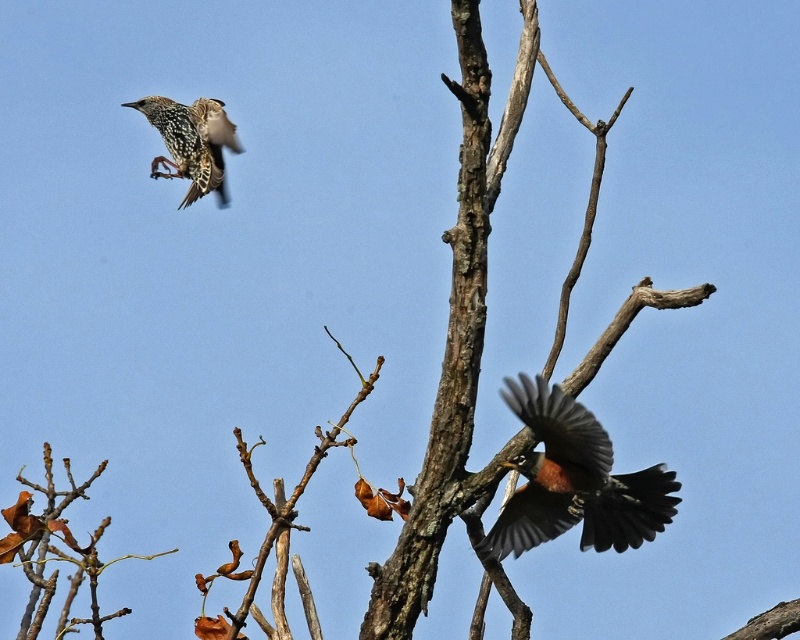
Is reddish-brown feathered bird at lower right thinner than bare branches at lower left?

Correct, reddish-brown feathered bird at lower right's width is less than bare branches at lower left's.

Does point (546, 529) come closer to viewer compared to point (56, 550)?

That is False.

Locate an element on the screen. This screenshot has height=640, width=800. reddish-brown feathered bird at lower right is located at coordinates (574, 481).

Who is more distant from viewer, (x=508, y=518) or (x=169, y=108)?

Point (x=508, y=518)

Which is more to the right, reddish-brown feathered bird at lower right or speckled feathered bird at upper left?

reddish-brown feathered bird at lower right

This screenshot has height=640, width=800. Identify the location of reddish-brown feathered bird at lower right. (574, 481).

Is bare branches at lower left to the left of speckled feathered bird at upper left from the viewer's perspective?

Indeed, bare branches at lower left is positioned on the left side of speckled feathered bird at upper left.

Does point (46, 532) lie in front of point (178, 124)?

Yes, it is.

Identify the location of bare branches at lower left. (56, 552).